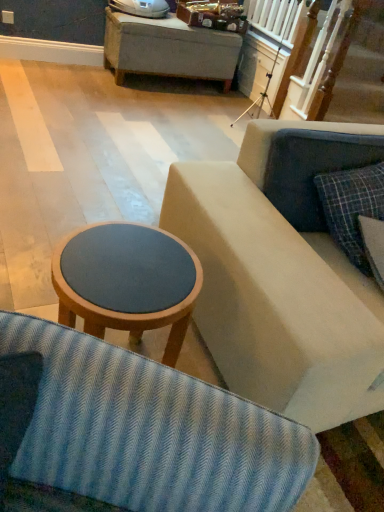
Question: Relative to plaid fabric pillow at right, is matte wood stool at center in front or behind?

Choices:
 (A) front
 (B) behind

Answer: (A)

Question: Is matte wood stool at center bigger or smaller than plaid fabric pillow at right?

Choices:
 (A) small
 (B) big

Answer: (B)

Question: Which is correct: matte wood stool at center is inside plaid fabric pillow at right, or outside of it?

Choices:
 (A) outside
 (B) inside

Answer: (A)

Question: From the image's perspective, relative to matte wood stool at center, is plaid fabric pillow at right above or below?

Choices:
 (A) above
 (B) below

Answer: (A)

Question: Relative to matte wood stool at center, is plaid fabric pillow at right in front or behind?

Choices:
 (A) front
 (B) behind

Answer: (B)

Question: Considering the positions of plaid fabric pillow at right and matte wood stool at center in the image, is plaid fabric pillow at right taller or shorter than matte wood stool at center?

Choices:
 (A) short
 (B) tall

Answer: (A)

Question: Is point (365, 193) positioned closer to the camera than point (104, 223)?

Choices:
 (A) farther
 (B) closer

Answer: (A)